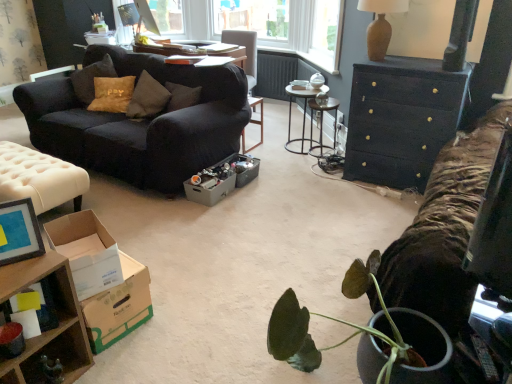
Question: From the image's perspective, is metallic gray box at center positioned above or below brown textured vase at upper right?

Choices:
 (A) above
 (B) below

Answer: (B)

Question: Considering their positions, is metallic gray box at center located in front of or behind brown textured vase at upper right?

Choices:
 (A) behind
 (B) front

Answer: (A)

Question: Which of these objects is positioned farthest from the brown cardboard box at lower left, acting as the second cardboard box starting from the front?

Choices:
 (A) metallic silver table at center, which ranks as the third table in front-to-back order
 (B) matte black couch at left
 (C) brown textured vase at upper right
 (D) metallic silver desk at center
 (E) metallic gray box at center

Answer: (D)

Question: Which object is the closest to the white cardboard box at lower left, the 3th cardboard box from the back?

Choices:
 (A) gray cardboard box at center, which is the first cardboard box from back to front
 (B) brown cardboard box at lower left, the 2th cardboard box in the back-to-front sequence
 (C) metallic gray box at center
 (D) matte blue picture frame at lower left
 (E) tufted leather ottoman at left, the second table viewed from the front

Answer: (B)